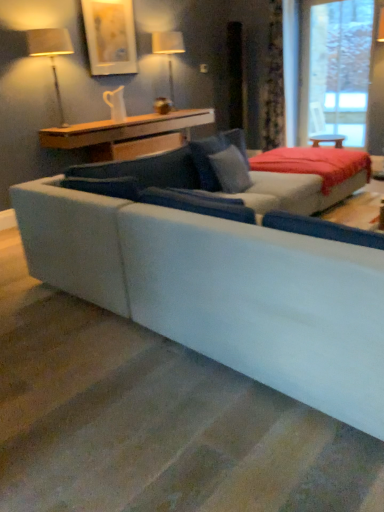
You are a GUI agent. You are given a task and a screenshot of the screen. Output one action in this format:
    pyautogui.click(x=<x>, y=<y>)
    Task: Click on the transparent glass window at upper right
    
    Given the screenshot: What is the action you would take?
    pyautogui.click(x=340, y=69)

At what (x,y) coordinates should I click in order to perform the action: click on white fabric lampshade at upper center, acting as the first table lamp starting from the back. Please return your answer as a coordinate pair (x, y). Looking at the image, I should click on (168, 51).

The image size is (384, 512). Identify the location of matte gold picture frame at upper center. (110, 36).

Describe the element at coordinates (274, 82) in the screenshot. I see `velvet floral curtain at upper right` at that location.

This screenshot has height=512, width=384. What do you see at coordinates (231, 170) in the screenshot?
I see `suede blue pillow at center` at bounding box center [231, 170].

Locate an element on the screen. velvet gray bed at center is located at coordinates (315, 174).

The image size is (384, 512). In the image, there is a matte gold picture frame at upper center. In order to click on table below it (from the image's perspective) in this screenshot , I will do `click(126, 134)`.

From a real-world perspective, between matte gold picture frame at upper center and wooden table at upper center, who is vertically higher?

From a 3D spatial view, matte gold picture frame at upper center is above.

Which is more to the left, matte gold picture frame at upper center or wooden table at upper center?

Positioned to the left is matte gold picture frame at upper center.

Is transparent glass window at upper right facing away from suede gray couch at center?

No, transparent glass window at upper right's orientation is not away from suede gray couch at center.

From the picture: How many degrees apart are the facing directions of transparent glass window at upper right and suede gray couch at center?

The angle between the facing direction of transparent glass window at upper right and the facing direction of suede gray couch at center is 179 degrees.

Which of these two, transparent glass window at upper right or suede gray couch at center, is wider?

suede gray couch at center is wider.

Is transparent glass window at upper right further to the viewer compared to suede gray couch at center?

Answer: Yes, the depth of transparent glass window at upper right is greater than that of suede gray couch at center.

Is matte gold picture frame at upper center taller than suede gray couch at center?

No, matte gold picture frame at upper center is not taller than suede gray couch at center.

Is point (96, 38) farther from camera compared to point (174, 323)?

Yes, it is.

Is matte gold picture frame at upper center to the right of suede gray couch at center from the viewer's perspective?

No.

What's the angular difference between velvet floral curtain at upper right and velvet gray bed at center's facing directions?

89.4 degrees separate the facing orientations of velvet floral curtain at upper right and velvet gray bed at center.

Choose the correct answer: Is velvet floral curtain at upper right inside velvet gray bed at center or outside it?

velvet floral curtain at upper right is outside velvet gray bed at center.

In the scene shown: From a real-world perspective, is velvet floral curtain at upper right located beneath velvet gray bed at center?

No, from a real-world perspective, velvet floral curtain at upper right is not under velvet gray bed at center.

Is velvet floral curtain at upper right closer to the viewer compared to velvet gray bed at center?

No, velvet floral curtain at upper right is behind velvet gray bed at center.

Is suede blue pillow at center at the right side of matte gold picture frame at upper center?

Yes, suede blue pillow at center is to the right of matte gold picture frame at upper center.

Considering the sizes of objects suede blue pillow at center and matte gold picture frame at upper center in the image provided, who is thinner, suede blue pillow at center or matte gold picture frame at upper center?

Thinner between the two is matte gold picture frame at upper center.

Where is `picture frame behind the suede blue pillow at center`? Image resolution: width=384 pixels, height=512 pixels. picture frame behind the suede blue pillow at center is located at coordinates [110, 36].

From a real-world perspective, which object rests below the other?

velvet gray bed at center, from a real-world perspective.

Who is more distant, velvet gray bed at center or wooden table at upper center?

Positioned behind is wooden table at upper center.

How many degrees apart are the facing directions of velvet gray bed at center and wooden table at upper center?

The angle between the facing direction of velvet gray bed at center and the facing direction of wooden table at upper center is 0.0651 degrees.

Is velvet gray bed at center taller or shorter than wooden table at upper center?

velvet gray bed at center is shorter than wooden table at upper center.

Is white fabric lampshade at upper center, acting as the first table lamp starting from the back, located within suede gray couch at center?

No, white fabric lampshade at upper center, acting as the first table lamp starting from the back, is located outside of suede gray couch at center.

Which is farther from the camera, (298,345) or (171,46)?

The point (171,46) is more distant.

Relative to white fabric lampshade at upper center, which is the 2th table lamp in left-to-right order, is suede gray couch at center in front or behind?

Clearly, suede gray couch at center is in front of white fabric lampshade at upper center, which is the 2th table lamp in left-to-right order.

Is suede gray couch at center placed right next to white fabric lampshade at upper center, which is counted as the 2th table lamp, starting from the front?

No, suede gray couch at center is not making contact with white fabric lampshade at upper center, which is counted as the 2th table lamp, starting from the front.

Where is `table located underneath the matte gold picture frame at upper center (from a real-world perspective)`? This screenshot has height=512, width=384. table located underneath the matte gold picture frame at upper center (from a real-world perspective) is located at coordinates (126, 134).

Where is `studio couch in front of the transparent glass window at upper right`? The width and height of the screenshot is (384, 512). studio couch in front of the transparent glass window at upper right is located at coordinates (221, 273).

From the image, which object appears to be nearer to white fabric lampshade at upper center, acting as the first table lamp starting from the back, wooden table at upper center or suede blue pillow at center?

Among the two, wooden table at upper center is located nearer to white fabric lampshade at upper center, acting as the first table lamp starting from the back.

Based on their spatial positions, is matte gold picture frame at upper center or wooden table at upper center further from velvet floral curtain at upper right?

matte gold picture frame at upper center lies further to velvet floral curtain at upper right than the other object.

Looking at this image, considering their positions, is white fabric lampshade at upper center, which ranks as the 1th table lamp in right-to-left order, positioned closer to matte silver table lamp at upper left, the 1th table lamp positioned from the left, than wooden table at upper center?

wooden table at upper center is positioned closer to the anchor matte silver table lamp at upper left, the 1th table lamp positioned from the left.

Based on their spatial positions, is matte silver table lamp at upper left, which appears as the 1th table lamp when viewed from the front, or white fabric lampshade at upper center, which is counted as the 2th table lamp, starting from the front, closer to velvet floral curtain at upper right?

white fabric lampshade at upper center, which is counted as the 2th table lamp, starting from the front.

Which object lies further to the anchor point transparent glass window at upper right, velvet floral curtain at upper right or matte silver table lamp at upper left, the 1th table lamp positioned from the left?

The object further to transparent glass window at upper right is matte silver table lamp at upper left, the 1th table lamp positioned from the left.

Based on their spatial positions, is matte gold picture frame at upper center or velvet gray bed at center further from white fabric lampshade at upper center, acting as the first table lamp starting from the back?

velvet gray bed at center.

Estimate the real-world distances between objects in this image. Which object is further from transparent glass window at upper right, wooden table at upper center or suede gray couch at center?

suede gray couch at center is further to transparent glass window at upper right.

Based on their spatial positions, is suede blue pillow at center or matte gold picture frame at upper center closer to white fabric lampshade at upper center, acting as the first table lamp starting from the back?

matte gold picture frame at upper center is positioned closer to the anchor white fabric lampshade at upper center, acting as the first table lamp starting from the back.

You are a GUI agent. You are given a task and a screenshot of the screen. Output one action in this format:
    pyautogui.click(x=<x>, y=<y>)
    Task: Click on the curtain between matte silver table lamp at upper left, the 2th table lamp positioned from the back, and velvet gray bed at center
    Image resolution: width=384 pixels, height=512 pixels.
    Given the screenshot: What is the action you would take?
    pyautogui.click(x=274, y=82)

This screenshot has width=384, height=512. Identify the location of bed frame between suede gray couch at center and matte silver table lamp at upper left, which appears as the 1th table lamp when viewed from the front, along the z-axis. (x=315, y=174).

At what (x,y) coordinates should I click in order to perform the action: click on pillow between wooden table at upper center and transparent glass window at upper right in the horizontal direction. Please return your answer as a coordinate pair (x, y). Looking at the image, I should click on (231, 170).

At what (x,y) coordinates should I click in order to perform the action: click on pillow located between matte gold picture frame at upper center and transparent glass window at upper right in the left-right direction. Please return your answer as a coordinate pair (x, y). This screenshot has height=512, width=384. Looking at the image, I should click on 231,170.